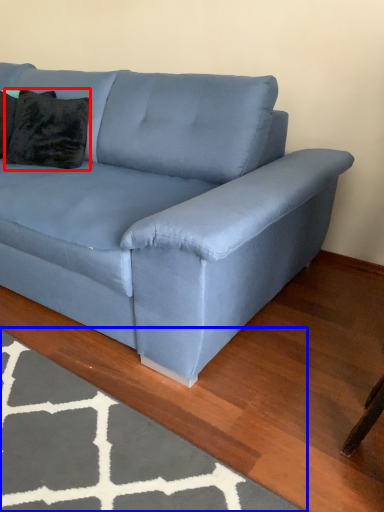
Question: Which object appears farthest to the camera in this image, pillow (highlighted by a red box) or mat (highlighted by a blue box)?

Choices:
 (A) pillow
 (B) mat

Answer: (A)